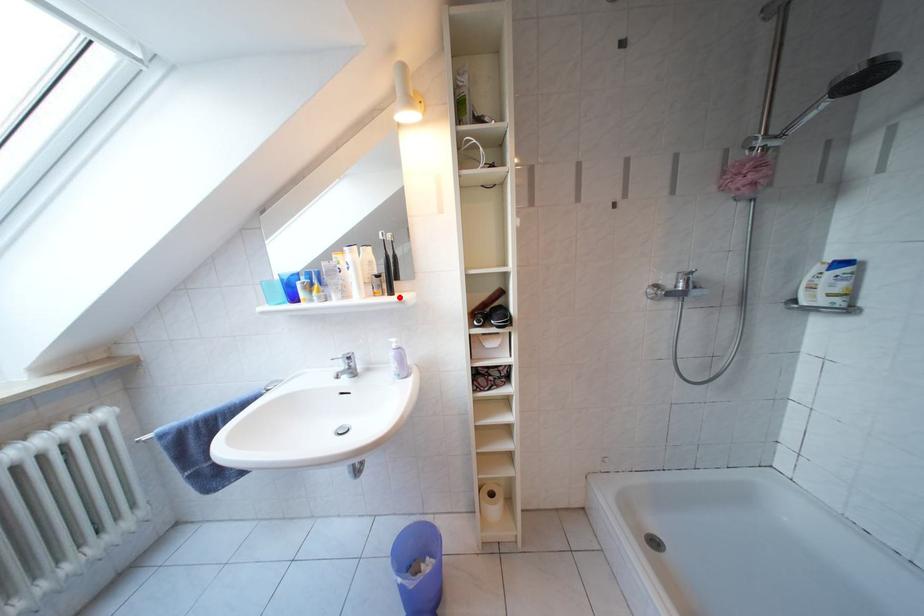
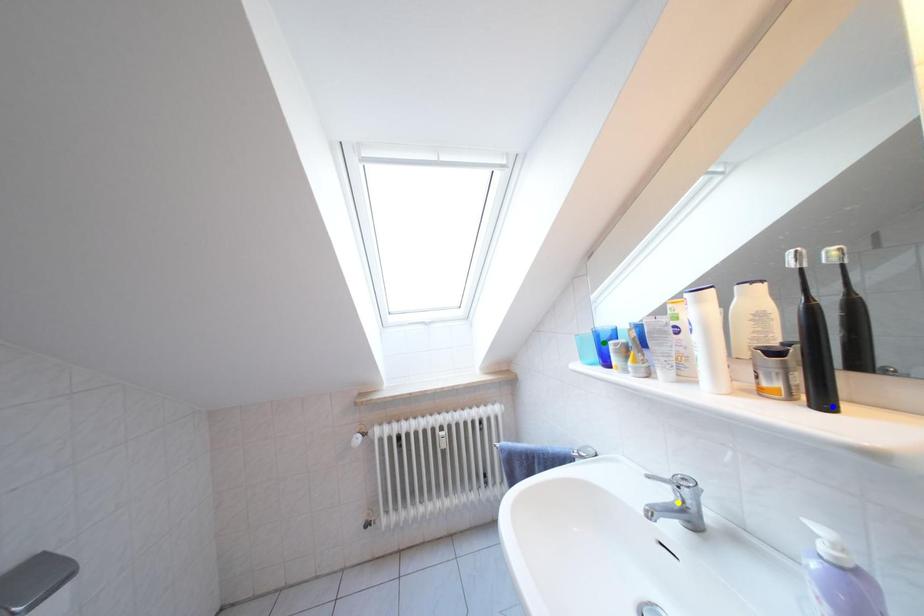
Question: I am providing you with two images of the same scene from different viewpoints. A red point is marked on the first image. You are given multiple points on the second image. In image 2, which mark is for the same physical point as the one in image 1?

Choices:
 (A) yellow point
 (B) blue point
 (C) green point

Answer: (B)